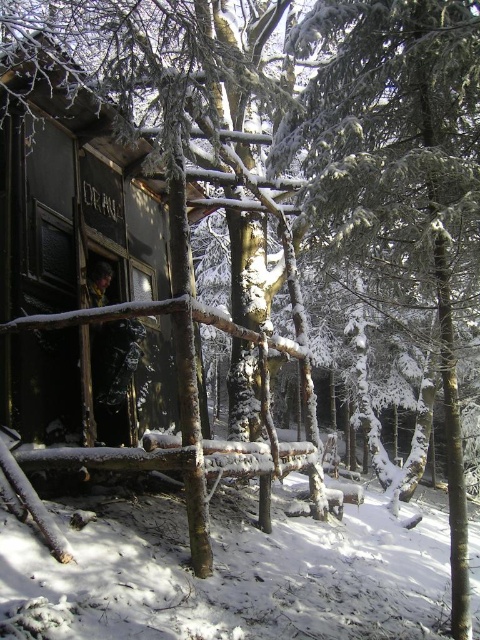
Question: Can you confirm if black wooden cabin at left is thinner than white fluffy snow at lower left?

Choices:
 (A) yes
 (B) no

Answer: (A)

Question: Which object appears closest to the camera in this image?

Choices:
 (A) black wooden cabin at left
 (B) white fluffy snow at lower left

Answer: (B)

Question: Can you confirm if black wooden cabin at left is positioned to the right of white fluffy snow at lower left?

Choices:
 (A) no
 (B) yes

Answer: (A)

Question: Which point is closer to the camera?

Choices:
 (A) click(x=24, y=392)
 (B) click(x=3, y=522)

Answer: (B)

Question: Does black wooden cabin at left have a smaller size compared to white fluffy snow at lower left?

Choices:
 (A) yes
 (B) no

Answer: (A)